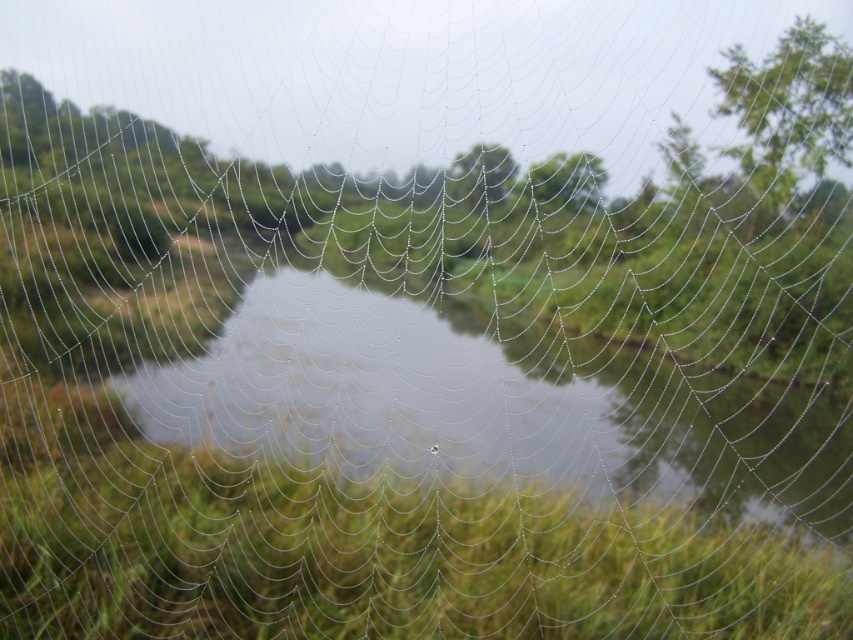
Question: Which of these objects is positioned closest to the green leafy tree at center?

Choices:
 (A) green leafy tree at upper right
 (B) transparent water at center

Answer: (B)

Question: Which object is the farthest from the green leafy tree at center?

Choices:
 (A) transparent water at center
 (B) green leafy tree at upper center
 (C) green leafy tree at upper right

Answer: (C)

Question: Based on their relative distances, which object is farther from the transparent water at center?

Choices:
 (A) green leafy tree at center
 (B) green leafy tree at upper center

Answer: (B)

Question: Can you confirm if green leafy tree at upper right is positioned to the left of green leafy tree at upper center?

Choices:
 (A) yes
 (B) no

Answer: (B)

Question: In this image, where is transparent water at center located relative to green leafy tree at upper right?

Choices:
 (A) above
 (B) below

Answer: (B)

Question: Does transparent water at center appear under green leafy tree at upper center?

Choices:
 (A) yes
 (B) no

Answer: (A)